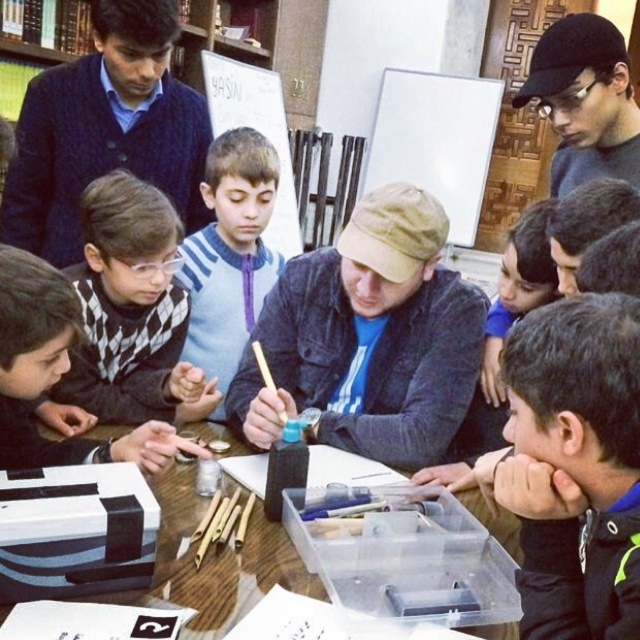
Question: Among these objects, which one is farthest from the camera?

Choices:
 (A) dark blue fleece at lower right
 (B) wooden table at center
 (C) dark blue sweater at upper left

Answer: (C)

Question: Can you confirm if khaki fabric cap at center is positioned to the left of light blue sweater at center?

Choices:
 (A) yes
 (B) no

Answer: (B)

Question: Which object is positioned closest to the black matte cap at upper right?

Choices:
 (A) light blue sweater at center
 (B) dark blue sweater at upper left
 (C) khaki fabric cap at center

Answer: (C)

Question: Is dark blue sweater at upper left to the left of black checkered sweater at lower left from the viewer's perspective?

Choices:
 (A) yes
 (B) no

Answer: (A)

Question: Which of these objects is positioned farthest from the black matte cap at upper right?

Choices:
 (A) wooden table at center
 (B) dark blue fleece at lower right
 (C) light blue sweater at center
 (D) khaki fabric cap at center

Answer: (A)

Question: Considering the relative positions of light blue sweater at center and wooden table at center in the image provided, where is light blue sweater at center located with respect to wooden table at center?

Choices:
 (A) above
 (B) below

Answer: (A)